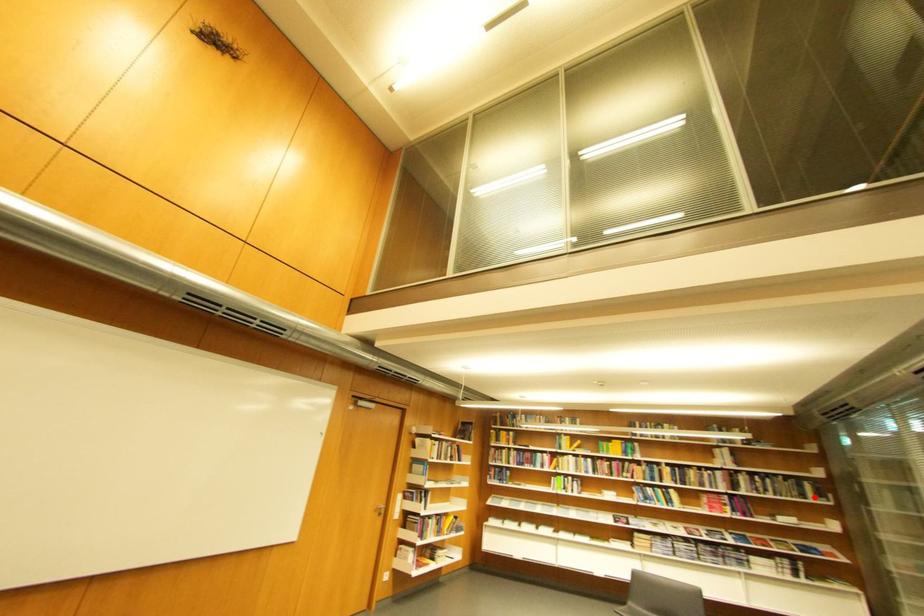
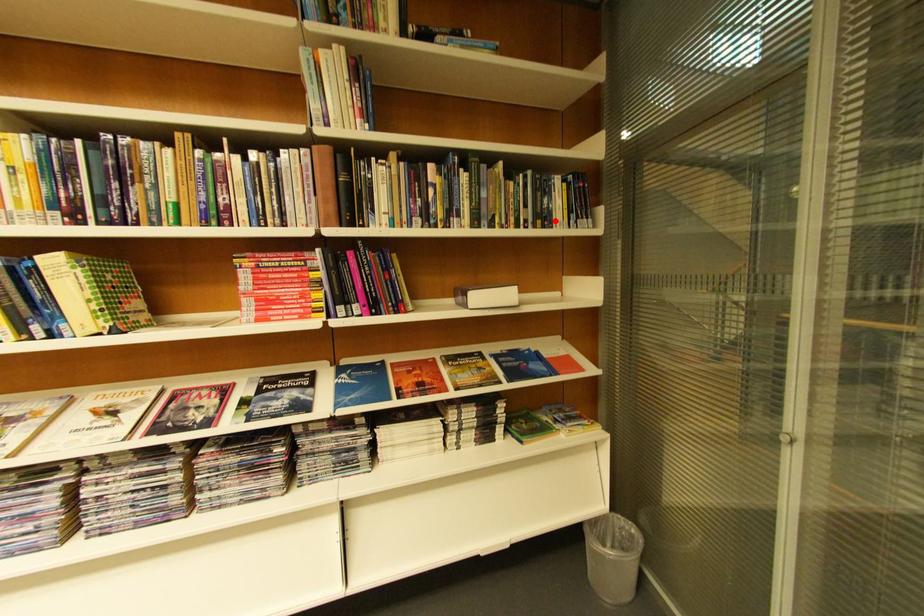
I am providing you with two images of the same scene from different viewpoints. A red point is marked on the first image and another point is marked on the second image. Is the marked point in image1 the same physical position as the marked point in image2?

Yes